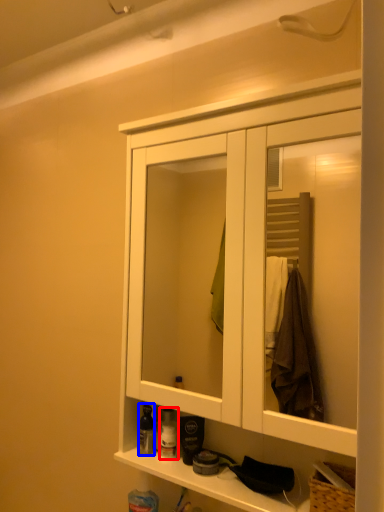
Question: Which object is closer to the camera taking this photo, toiletry (highlighted by a red box) or toiletry (highlighted by a blue box)?

Choices:
 (A) toiletry
 (B) toiletry

Answer: (B)